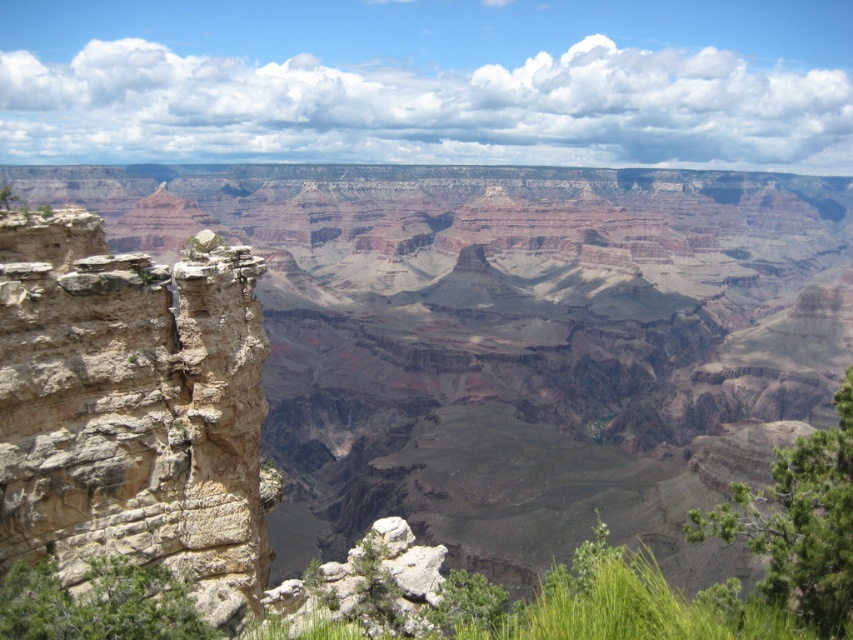
Is brown rocky canyon at left shorter than rustic stone cliff at left?

Incorrect, brown rocky canyon at left's height does not fall short of rustic stone cliff at left's.

Where is `brown rocky canyon at left`? brown rocky canyon at left is located at coordinates (514, 340).